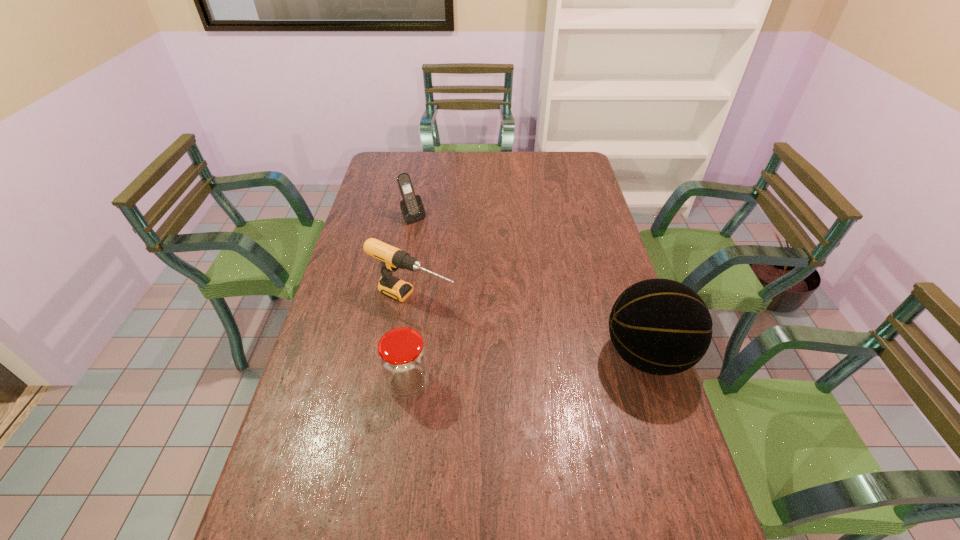
Identify the location of vacant space that satisfies the following two spatial constraints: 1. on the back side of the basketball; 2. on the left side of the jar. (412, 355).